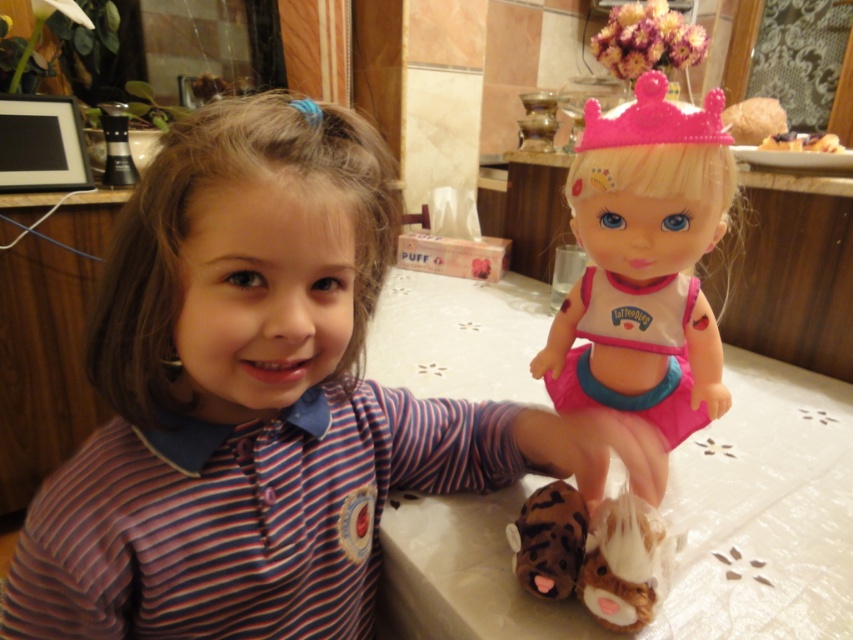
You are standing in front of the table where the child and doll are placed. There are two points marked on the table surface. The first point is at coordinates point (303,548) and the second point is at point (526,573). If you want to place a small sticker on the table such that it is closer to the child than to the doll, which point should you choose?

You should choose point (303,548) because it is closer to the child than point (526,573). Since the child is on the left side of the frame and the doll is on the right, the point in front of the other point would be nearer to the child.

You are a toy organizer who needs to arrange the pink plastic doll at center and the soft plush toys at lower center on a shelf. Based on their sizes, which object should be placed on the lower shelf to ensure stability?

The soft plush toys at lower center should be placed on the lower shelf because the pink plastic doll at center is taller and needs a higher shelf for stability.

You are organizing a toy store shelf and need to place the pink plastic doll at center and the soft plush toys at lower center side by side. Given their widths, which toy should be placed on the left to ensure they both fit on the shelf without overlapping?

The pink plastic doll at center is wider than the soft plush toys at lower center. To fit them side by side without overlapping, place the wider pink plastic doll at center on the left and the narrower soft plush toys at lower center on the right, or vice versa, ensuring the total width of both items does not exceed the shelf space available.